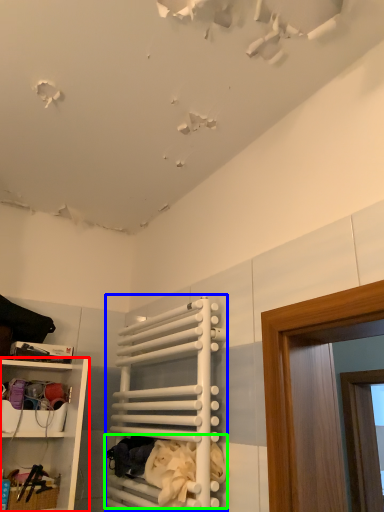
Question: Which is farther away from shelf (highlighted by a red box)? cabinet (highlighted by a blue box) or laundry (highlighted by a green box)?

Choices:
 (A) cabinet
 (B) laundry

Answer: (B)